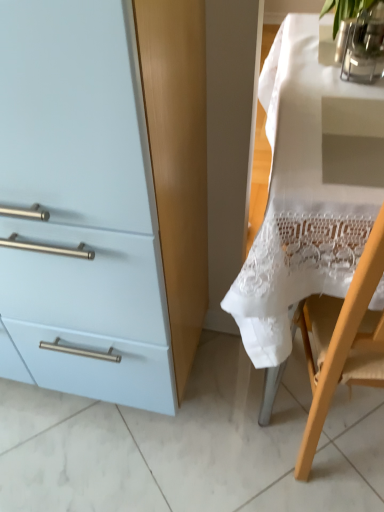
Image resolution: width=384 pixels, height=512 pixels. Identify the location of free spot behind clear glass vase at upper right, the 2th glass vase from the front. pyautogui.click(x=307, y=38).